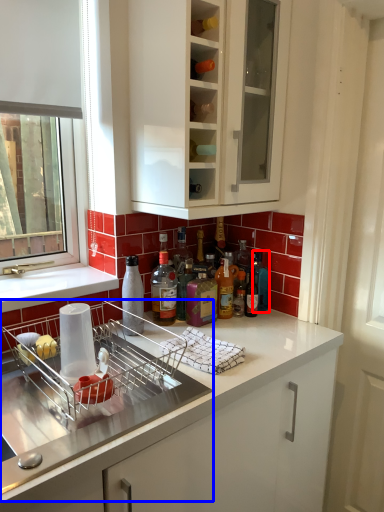
Question: Which object appears farthest to the camera in this image, bottle (highlighted by a red box) or dish washer (highlighted by a blue box)?

Choices:
 (A) bottle
 (B) dish washer

Answer: (A)